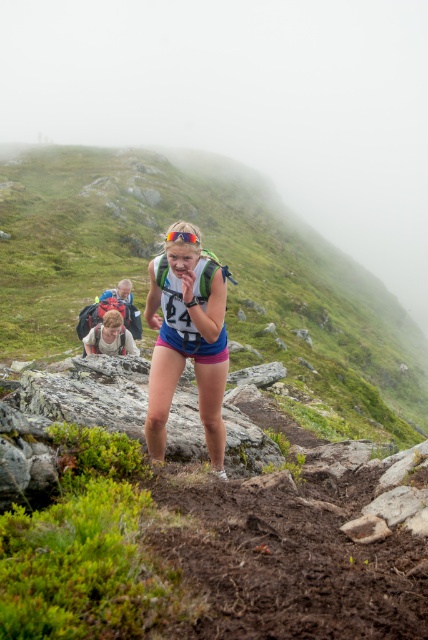
You are a runner participating in a mountain trail race and you see the matte gray backpack at lower left and the matte blue backpack at center. You need to place a 2.5 meter long safety rope between them. Will the rope reach between the two backpacks?

The matte gray backpack at lower left is 2.35 meters from the matte blue backpack at center. Since the rope is 2.5 meters long, it will reach between them with a little extra length remaining.

You are a drone operator trying to capture aerial footage of the mountainous trail. You have two points marked on your map for camera placement. The first is at point (180, 269) and the second at point (128, 340). Which point should you choose to get a better view of the runner in the foreground?

Point (180, 269) is closer to the viewer than point (128, 340), so choosing point (180, 269) will provide a better view of the runner in the foreground.